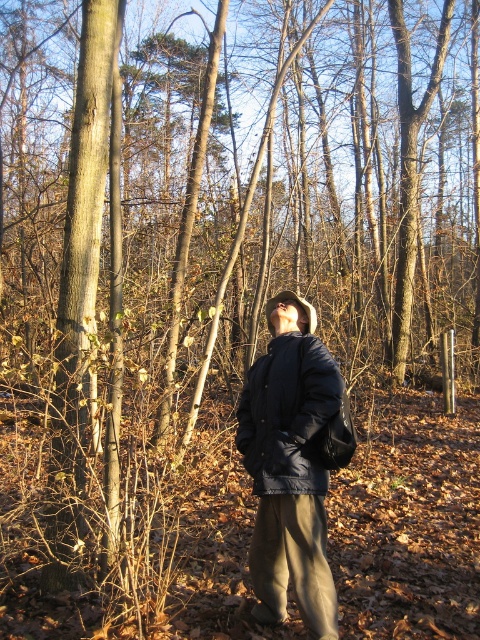
Question: Does matte black jacket at center have a larger size compared to smooth brown bark at center?

Choices:
 (A) yes
 (B) no

Answer: (B)

Question: Can you confirm if matte black jacket at center is thinner than navy blue quilted jacket at center?

Choices:
 (A) no
 (B) yes

Answer: (B)

Question: Among these objects, which one is farthest from the camera?

Choices:
 (A) smooth brown bark at center
 (B) navy blue quilted jacket at center

Answer: (A)

Question: Which of the following is the farthest from the observer?

Choices:
 (A) navy blue quilted jacket at center
 (B) matte black jacket at center

Answer: (A)

Question: Which of these objects is positioned closest to the matte black jacket at center?

Choices:
 (A) smooth brown bark at center
 (B) navy blue quilted jacket at center

Answer: (B)

Question: Can you confirm if matte black jacket at center is wider than smooth brown bark at center?

Choices:
 (A) no
 (B) yes

Answer: (B)